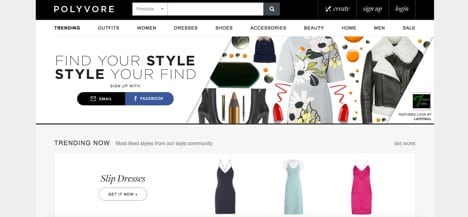
In order to click on makeup in this screenshot , I will do pos(237,108).